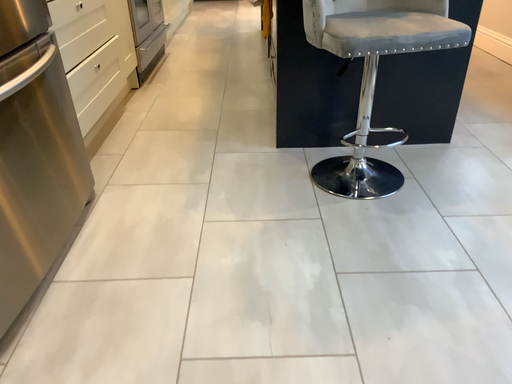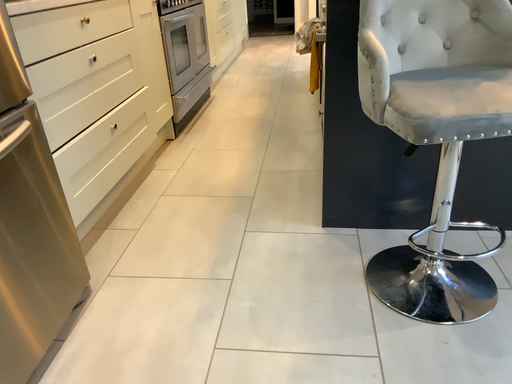
Question: How did the camera likely rotate when shooting the video?

Choices:
 (A) rotated left
 (B) rotated right

Answer: (A)